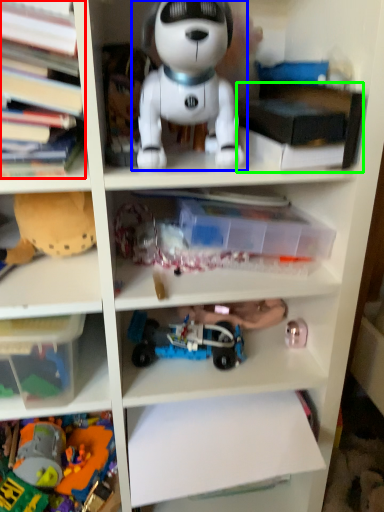
Question: Which is farther away from book (highlighted by a red box)? toy (highlighted by a blue box) or book (highlighted by a green box)?

Choices:
 (A) toy
 (B) book

Answer: (B)